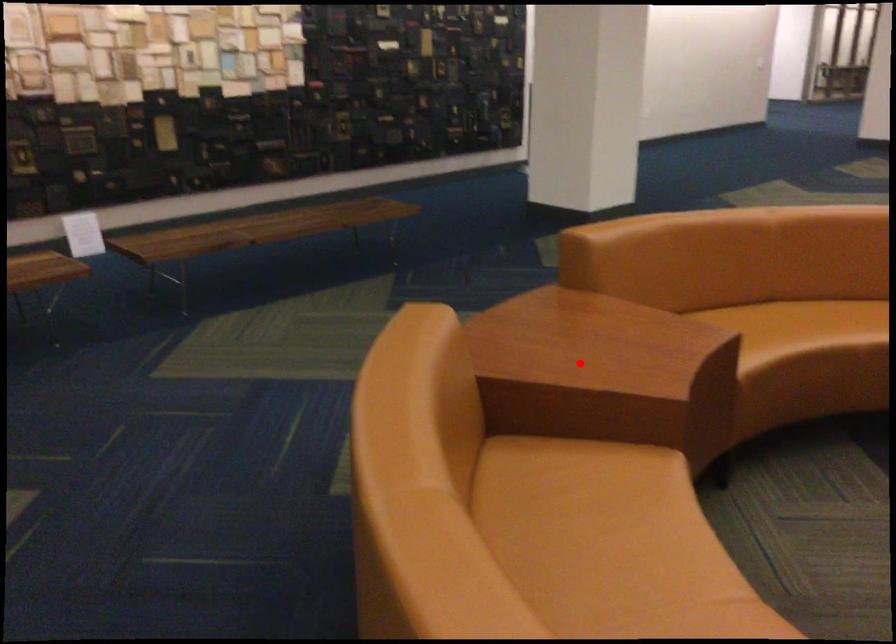
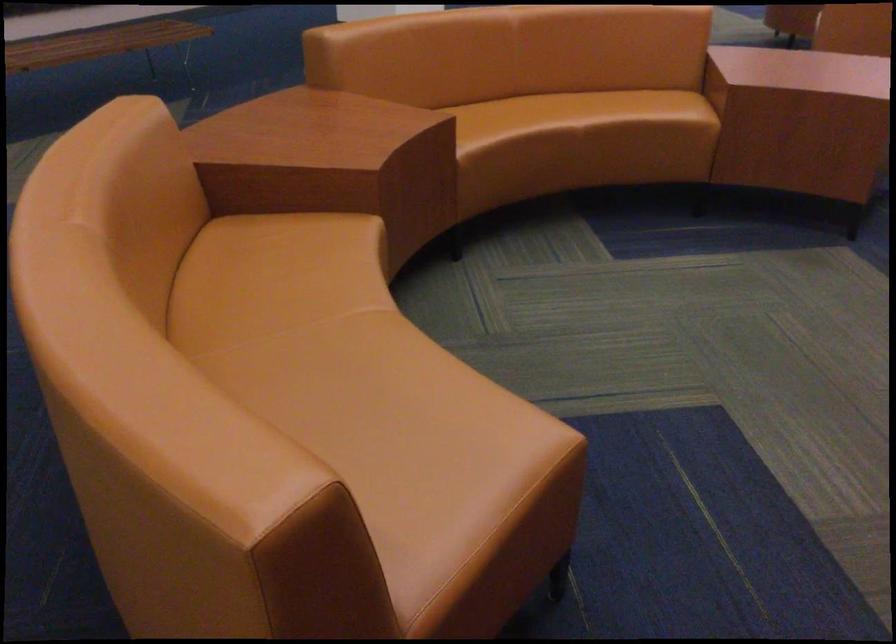
Where in the second image is the point corresponding to the highlighted location from the first image?

(297, 151)